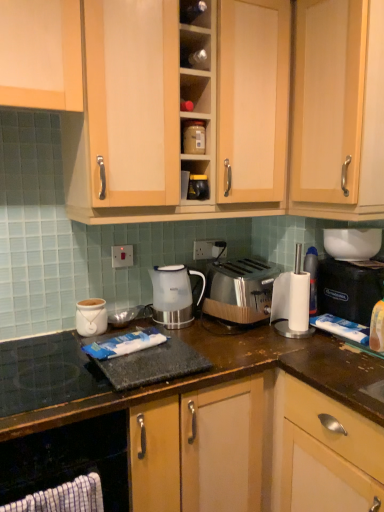
This screenshot has width=384, height=512. I want to click on free location in front of white glossy electric kettle at center, so click(197, 335).